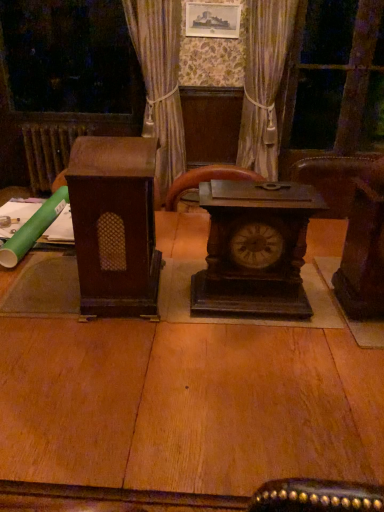
Image resolution: width=384 pixels, height=512 pixels. In order to click on free space to the right of dark brown wood clock at center in this screenshot , I will do `click(331, 306)`.